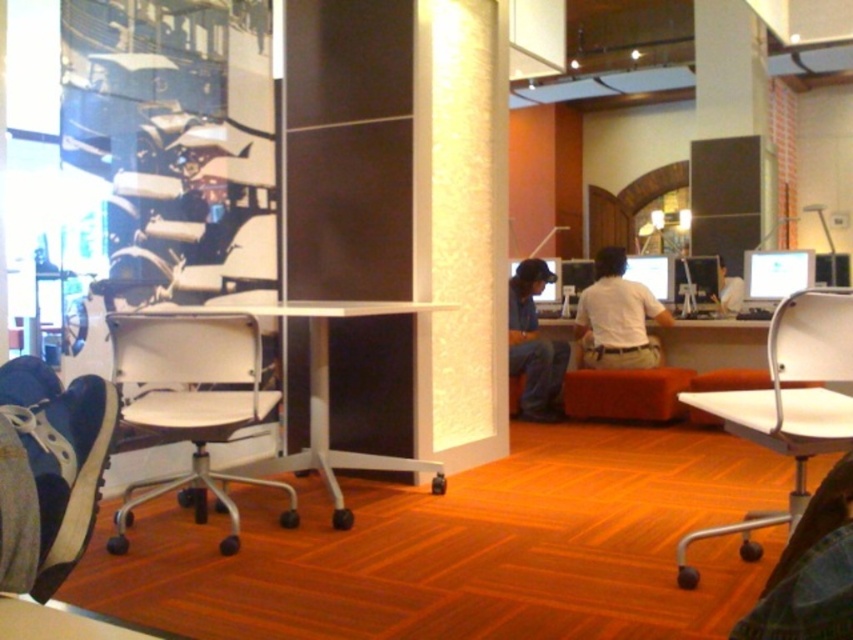
Based on the photo, you are organizing a meeting in the workspace and need to ensure there is enough space for a white plastic chair at center and a white cotton shirt at center. Based on their sizes, which object requires more horizontal space?

The white plastic chair at center requires more horizontal space because it is wider than the white cotton shirt at center.

You are organizing a meeting in this workspace and need to seat two people. There is a white plastic chair at center and a white cotton shirt at center. Which object is located to the left of the other?

The white plastic chair at center is positioned on the left side of white cotton shirt at center.